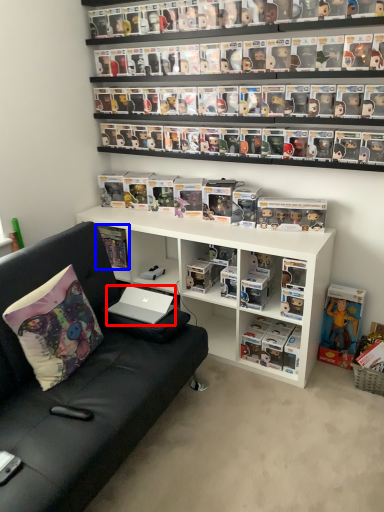
Question: Which object appears farthest to the camera in this image, laptop (highlighted by a red box) or book (highlighted by a blue box)?

Choices:
 (A) laptop
 (B) book

Answer: (B)